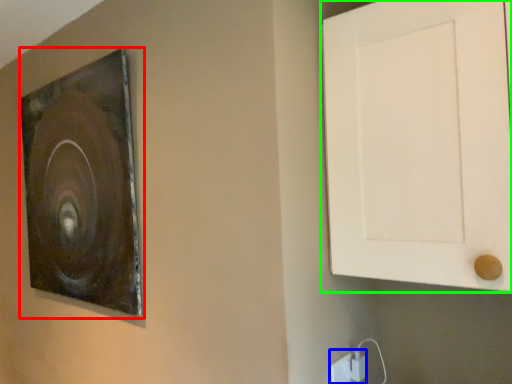
Question: Based on their relative distances, which object is farther from picture frame (highlighted by a red box)? Choose from electric outlet (highlighted by a blue box) and door (highlighted by a green box).

Choices:
 (A) electric outlet
 (B) door

Answer: (A)